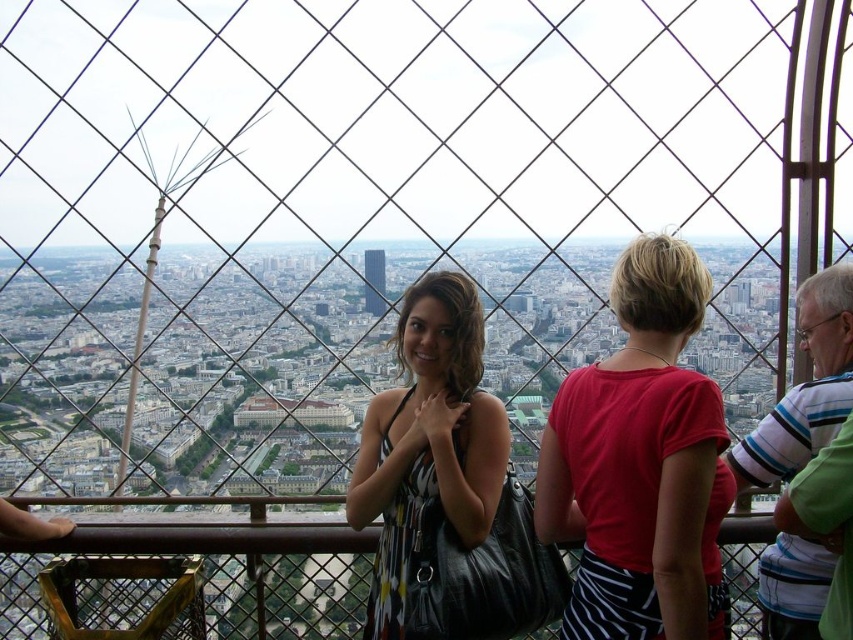
You are a photographer taking a picture of the Eiffel Tower from the inside. You notice the printed fabric dress at center and the brushed metal Eiffel Tower at left in your frame. Which object is closer to the camera?

The printed fabric dress at center is closer to the camera because it is in front of the brushed metal Eiffel Tower at left.

You are a photographer standing at the Eiffel Tower and want to take a photo of the red matte shirt at center and the printed fabric dress at center. The camera you are using has a maximum focus range of 20 meters. Can you capture both subjects in focus without moving closer?

The red matte shirt at center and the printed fabric dress at center are 19.13 meters apart. Since the distance between them is within the camera maximum focus range of 20 meters, you can capture both subjects in focus without moving closer.

You are standing at the Eiffel Tower and see the printed fabric dress at center in the distance. If you want to take a photo of it, would you need to use a zoom lens to capture it clearly from your current position?

The printed fabric dress at center is 98.08 meters away from the viewer. Since this distance is quite far, using a zoom lens would be necessary to capture it clearly from your current position.